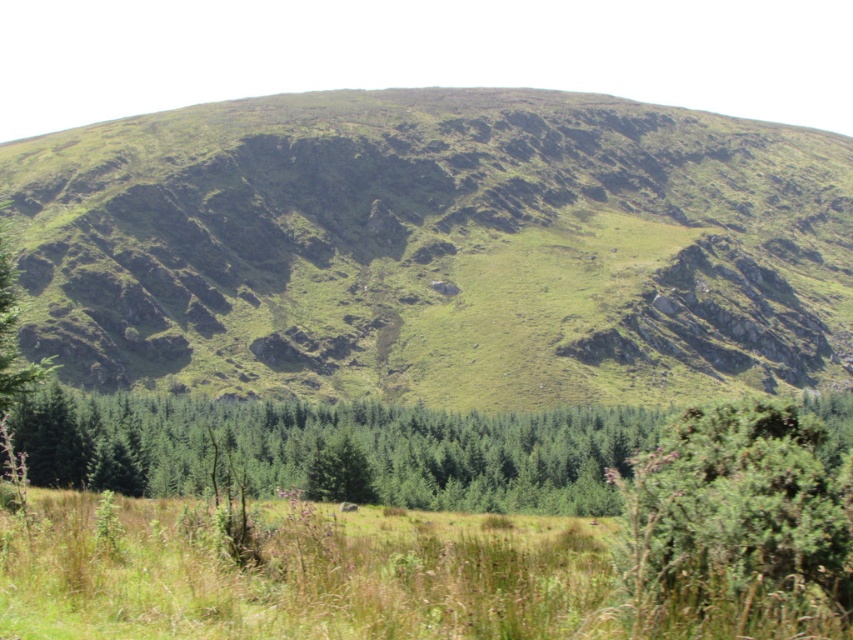
Question: Which object is the farthest from the green leafy bush at lower right?

Choices:
 (A) green grassy field at lower center
 (B) green grassy hill at center

Answer: (B)

Question: Does green matte trees at center appear over green leafy bush at lower right?

Choices:
 (A) yes
 (B) no

Answer: (B)

Question: Which is nearer to the green leafy bush at lower right?

Choices:
 (A) green grassy field at lower center
 (B) green matte trees at center
 (C) green grassy hill at center

Answer: (A)

Question: Is green grassy field at lower center wider than green matte trees at center?

Choices:
 (A) no
 (B) yes

Answer: (A)

Question: Which of the following is the closest to the observer?

Choices:
 (A) green grassy hill at center
 (B) green leafy bush at lower right
 (C) green grassy field at lower center

Answer: (C)

Question: Does green grassy hill at center have a smaller size compared to green matte trees at center?

Choices:
 (A) yes
 (B) no

Answer: (B)